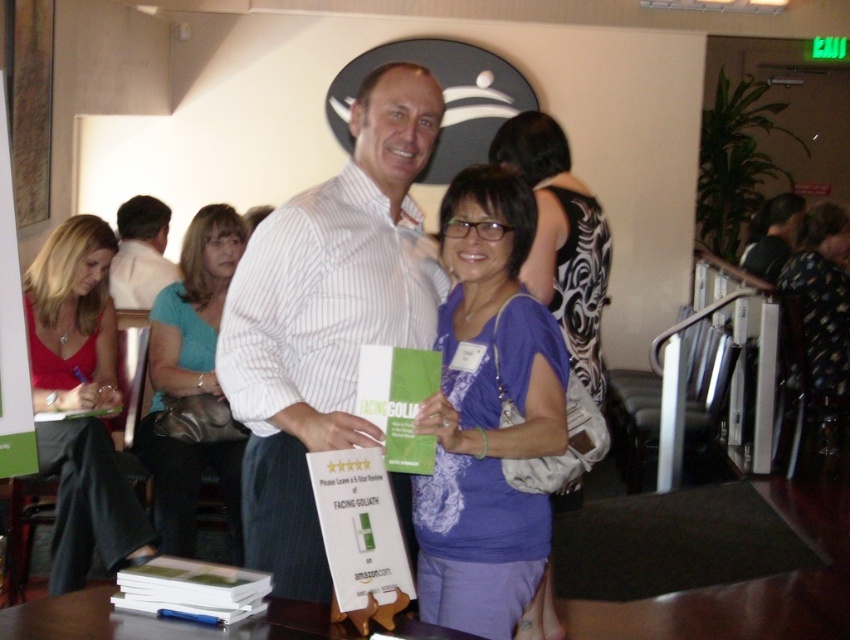
Is point (157, 380) farther from viewer compared to point (524, 124)?

Yes, it is behind point (524, 124).

Describe the element at coordinates (191, 381) in the screenshot. I see `teal fabric purse at center` at that location.

Who is more forward, (193, 522) or (527, 131)?

Point (527, 131) is more forward.

Identify the location of teal fabric purse at center. Image resolution: width=850 pixels, height=640 pixels. (191, 381).

Is point (344, 388) behind point (129, 202)?

No, (344, 388) is closer to viewer.

Which is in front, point (344, 365) or point (122, 301)?

Positioned in front is point (344, 365).

Locate an element on the screen. white striped shirt at center is located at coordinates (327, 317).

Is purple cotton shirt at center to the left of purple fabric shirt at center from the viewer's perspective?

Correct, you'll find purple cotton shirt at center to the left of purple fabric shirt at center.

Can you confirm if purple cotton shirt at center is wider than purple fabric shirt at center?

Incorrect, purple cotton shirt at center's width does not surpass purple fabric shirt at center's.

Who is more distant from viewer, (544, 548) or (505, 132)?

The point (505, 132) is behind.

The width and height of the screenshot is (850, 640). In order to click on purple cotton shirt at center in this screenshot , I will do `click(486, 413)`.